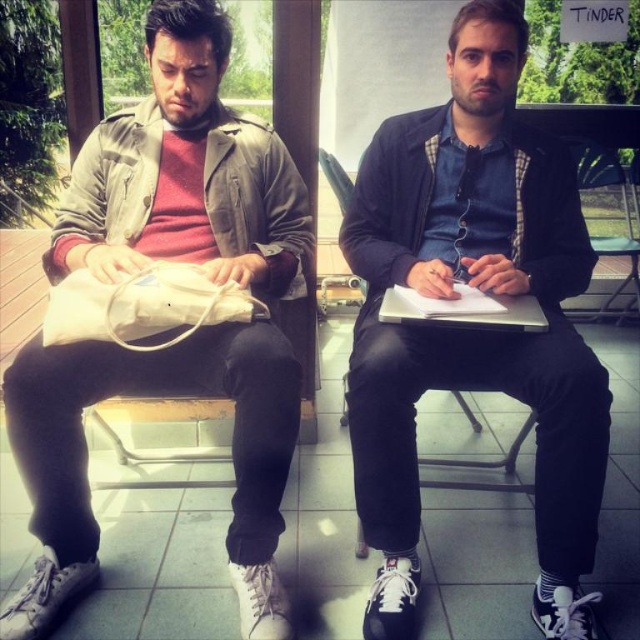
Question: Which point is farther to the camera?

Choices:
 (A) pos(372,460)
 (B) pos(403,317)

Answer: (A)

Question: Which object is positioned closest to the matte black jacket at center?

Choices:
 (A) silver metallic laptop at center
 (B) metallic silver chair at center

Answer: (A)

Question: Which point is closer to the camera taking this photo?

Choices:
 (A) (436, 314)
 (B) (611, 237)

Answer: (A)

Question: Is metallic silver chair at center above silver metallic laptop at center?

Choices:
 (A) no
 (B) yes

Answer: (B)

Question: Is matte black jacket at center further to camera compared to metallic silver chair at center?

Choices:
 (A) yes
 (B) no

Answer: (B)

Question: Does matte black jacket at center have a lesser width compared to metallic silver chair at center?

Choices:
 (A) yes
 (B) no

Answer: (A)